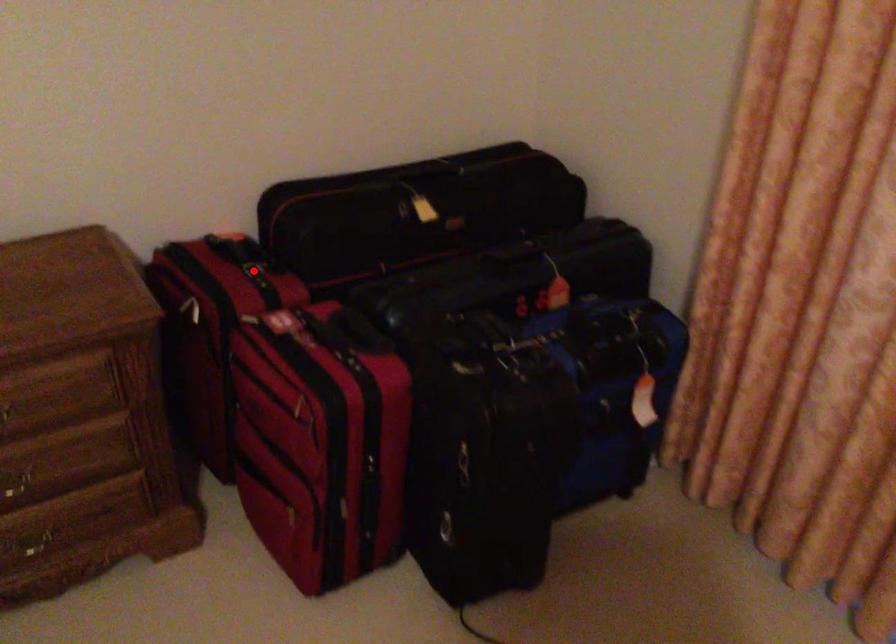
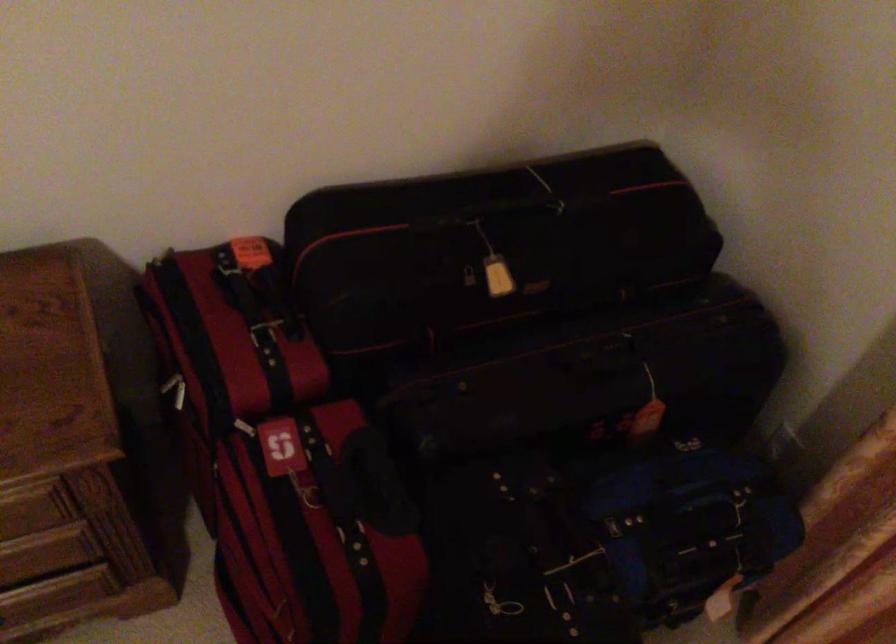
In the second image, find the point that corresponds to the highlighted location in the first image.

(264, 334)